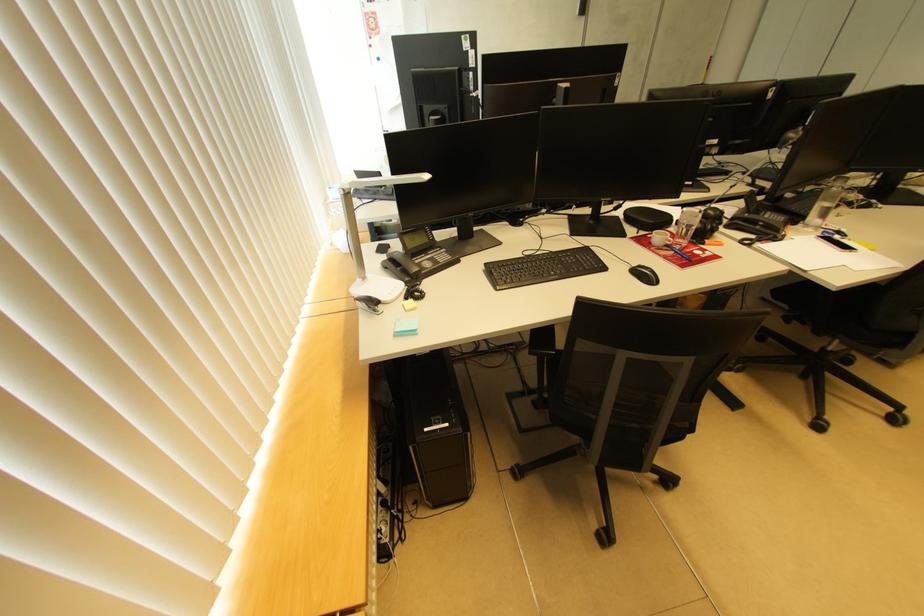
This screenshot has width=924, height=616. What are the coordinates of `white espresso cup` in the screenshot? It's located at (660, 238).